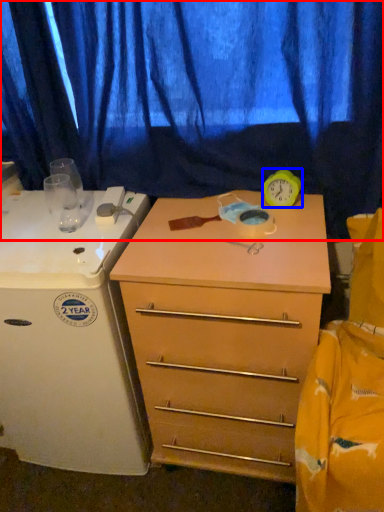
Question: Which of the following is the farthest to the observer, curtain (highlighted by a red box) or clock (highlighted by a blue box)?

Choices:
 (A) curtain
 (B) clock

Answer: (B)